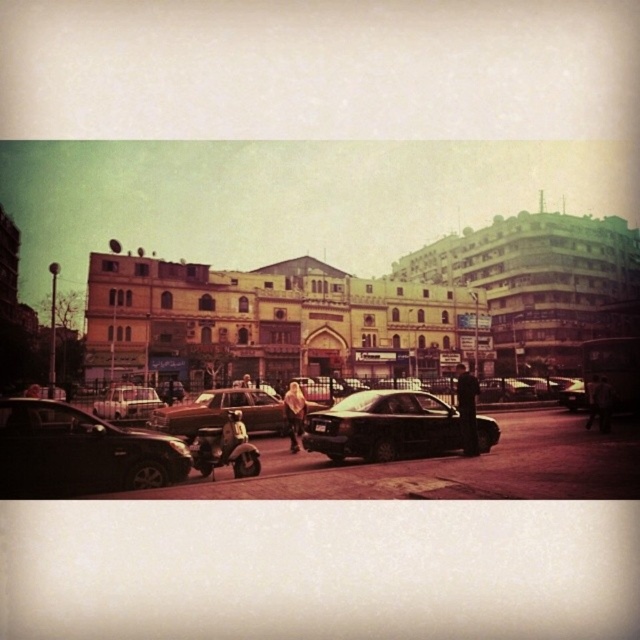
Is satin black sedan at center bigger than matte silver sedan at center?

Yes.

Can you confirm if satin black sedan at center is smaller than matte silver sedan at center?

Actually, satin black sedan at center might be larger than matte silver sedan at center.

Between point (428, 435) and point (104, 406), which one is positioned behind?

Point (104, 406)

Find the location of `satin black sedan at center`. satin black sedan at center is located at coordinates (384, 426).

Who is more forward, (115, 458) or (120, 390)?

Positioned in front is point (115, 458).

Between shiny black car at lower left and matte silver sedan at center, which one appears on the right side from the viewer's perspective?

Positioned to the right is shiny black car at lower left.

Which is in front, point (22, 452) or point (134, 404)?

Point (22, 452) is in front.

Where is `shiny black car at lower left`? shiny black car at lower left is located at coordinates (80, 452).

Can you confirm if matte silver sedan at center is thinner than shiny black sedan at center?

In fact, matte silver sedan at center might be wider than shiny black sedan at center.

Does matte silver sedan at center have a greater height compared to shiny black sedan at center?

Incorrect, matte silver sedan at center's height is not larger of shiny black sedan at center's.

You are a GUI agent. You are given a task and a screenshot of the screen. Output one action in this format:
    pyautogui.click(x=<x>, y=<y>)
    Task: Click on the matte silver sedan at center
    This screenshot has height=640, width=640.
    Given the screenshot: What is the action you would take?
    pyautogui.click(x=125, y=403)